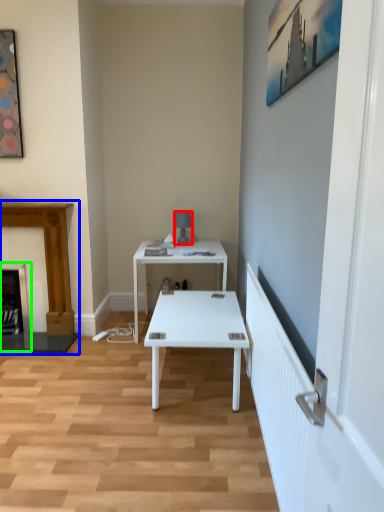
Question: Which object is positioned closest to lamp (highlighted by a red box)? Select from fireplace (highlighted by a blue box) and fireplace (highlighted by a green box).

Choices:
 (A) fireplace
 (B) fireplace

Answer: (A)